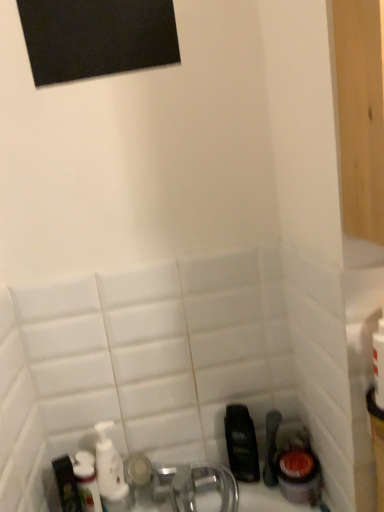
Question: Considering the relative sizes of white glossy mouthwash at lower left, the 1th mouthwash when ordered from left to right, and dark brown plastic mouthwash at lower right, the second mouthwash positioned from the left, in the image provided, is white glossy mouthwash at lower left, the 1th mouthwash when ordered from left to right, taller than dark brown plastic mouthwash at lower right, the second mouthwash positioned from the left,?

Choices:
 (A) no
 (B) yes

Answer: (B)

Question: From a real-world perspective, is white glossy mouthwash at lower left, the second mouthwash from the right, located beneath dark brown plastic mouthwash at lower right, which is the first mouthwash from right to left?

Choices:
 (A) no
 (B) yes

Answer: (A)

Question: Considering the relative sizes of white glossy mouthwash at lower left, the second mouthwash from the right, and dark brown plastic mouthwash at lower right, which is the first mouthwash from right to left, in the image provided, is white glossy mouthwash at lower left, the second mouthwash from the right, shorter than dark brown plastic mouthwash at lower right, which is the first mouthwash from right to left,?

Choices:
 (A) yes
 (B) no

Answer: (B)

Question: Is white glossy mouthwash at lower left, the second mouthwash from the right, smaller than dark brown plastic mouthwash at lower right, which is the first mouthwash from right to left?

Choices:
 (A) yes
 (B) no

Answer: (B)

Question: Is white glossy mouthwash at lower left, the second mouthwash from the right, not within dark brown plastic mouthwash at lower right, which is the first mouthwash from right to left?

Choices:
 (A) no
 (B) yes

Answer: (B)

Question: From a real-world perspective, is dark brown plastic mouthwash at lower right, the second mouthwash positioned from the left, above or below white glossy bottle at lower left?

Choices:
 (A) above
 (B) below

Answer: (B)

Question: From the image's perspective, is dark brown plastic mouthwash at lower right, the second mouthwash positioned from the left, above or below white glossy bottle at lower left?

Choices:
 (A) below
 (B) above

Answer: (B)

Question: Is dark brown plastic mouthwash at lower right, the second mouthwash positioned from the left, in front of or behind white glossy bottle at lower left in the image?

Choices:
 (A) front
 (B) behind

Answer: (B)

Question: Is dark brown plastic mouthwash at lower right, which is the first mouthwash from right to left, inside or outside of white glossy bottle at lower left?

Choices:
 (A) outside
 (B) inside

Answer: (A)

Question: From a real-world perspective, is white glossy mouthwash at lower left, the 1th mouthwash when ordered from left to right, above or below white glossy bottle at lower left?

Choices:
 (A) below
 (B) above

Answer: (A)

Question: Is white glossy mouthwash at lower left, the second mouthwash from the right, inside or outside of white glossy bottle at lower left?

Choices:
 (A) inside
 (B) outside

Answer: (B)

Question: Considering the positions of white glossy mouthwash at lower left, the second mouthwash from the right, and white glossy bottle at lower left in the image, is white glossy mouthwash at lower left, the second mouthwash from the right, wider or thinner than white glossy bottle at lower left?

Choices:
 (A) thin
 (B) wide

Answer: (B)

Question: Would you say white glossy mouthwash at lower left, the 1th mouthwash when ordered from left to right, is to the left or to the right of white glossy bottle at lower left in the picture?

Choices:
 (A) right
 (B) left

Answer: (A)

Question: Based on their sizes in the image, would you say white glossy bottle at lower left is bigger or smaller than white glossy mouthwash at lower left, the second mouthwash from the right?

Choices:
 (A) small
 (B) big

Answer: (A)

Question: Considering the relative positions of white glossy bottle at lower left and white glossy mouthwash at lower left, the second mouthwash from the right, in the image provided, is white glossy bottle at lower left to the left or to the right of white glossy mouthwash at lower left, the second mouthwash from the right,?

Choices:
 (A) left
 (B) right

Answer: (A)